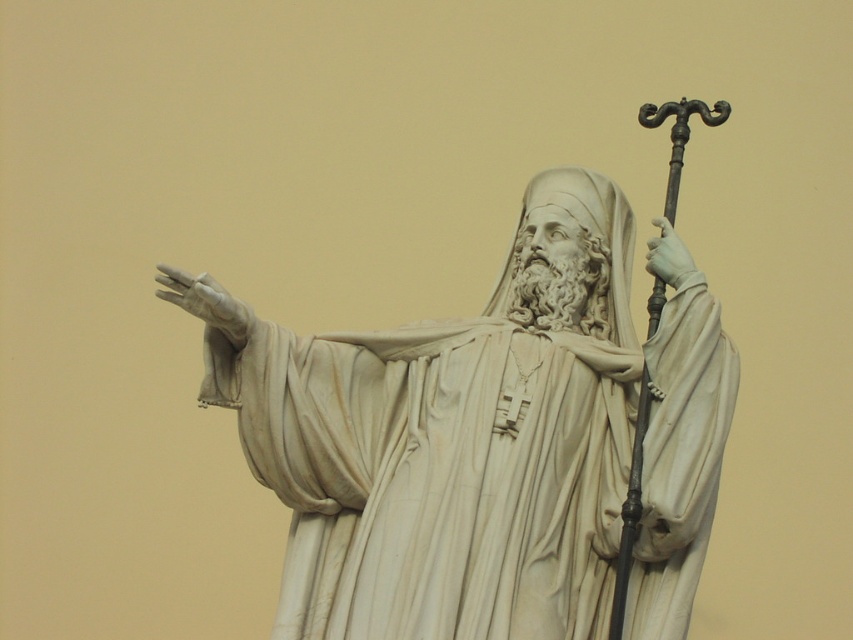
Is point (618, 492) behind point (167, 269)?

Yes, it is.

Does white marble statue at center appear on the left side of white marble hand at center-left?

No, white marble statue at center is not to the left of white marble hand at center-left.

In the scene shown: Who is more forward, (567,237) or (221,323)?

Point (221,323)

Locate an element on the screen. Image resolution: width=853 pixels, height=640 pixels. white marble statue at center is located at coordinates (492, 445).

Which is more to the right, white marble hand at center-left or white marble hand at center-right?

Positioned to the right is white marble hand at center-right.

Does point (231, 342) lie behind point (664, 234)?

Yes.

Where is `white marble hand at center-left`? This screenshot has height=640, width=853. white marble hand at center-left is located at coordinates (206, 301).

Is white marble statue at center closer to camera compared to white marble hand at center-right?

Yes.

Who is higher up, white marble statue at center or white marble hand at center-right?

white marble hand at center-right is above.

Locate an element on the screen. The height and width of the screenshot is (640, 853). white marble statue at center is located at coordinates (492, 445).